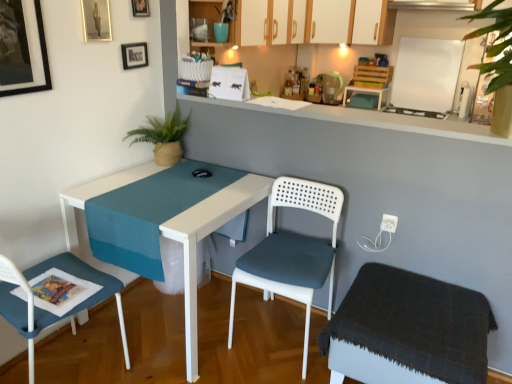
Where is `blank area beneath white plastic chair at center, which appears as the 2th chair when viewed from the left (from a real-world perspective)`? This screenshot has height=384, width=512. blank area beneath white plastic chair at center, which appears as the 2th chair when viewed from the left (from a real-world perspective) is located at coordinates 279,334.